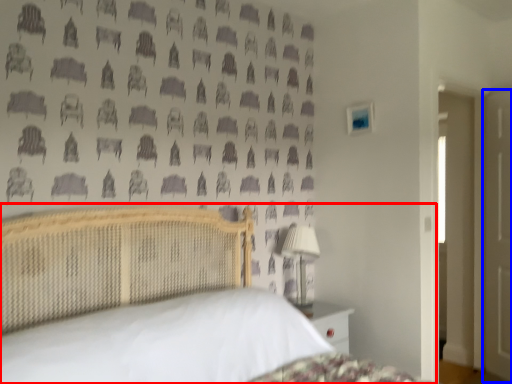
Question: Which point is closer to the camera, bed (highlighted by a red box) or door (highlighted by a blue box)?

Choices:
 (A) bed
 (B) door

Answer: (A)